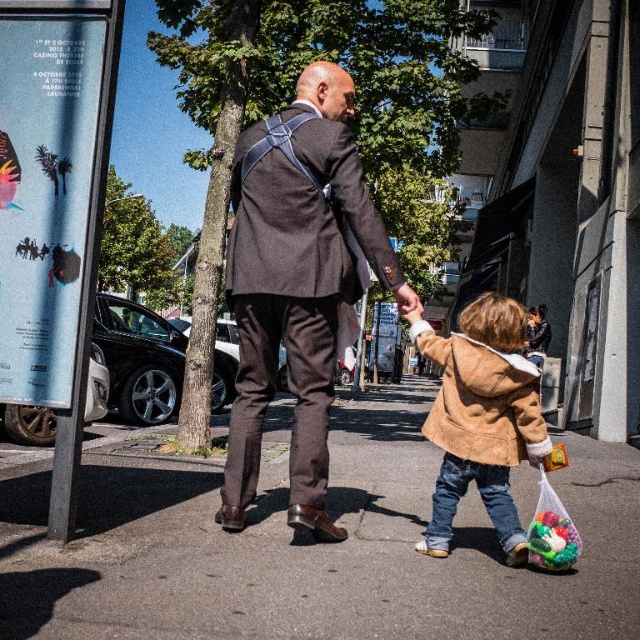
Question: Can you confirm if asphalt at center is positioned below tan suede jacket at lower right?

Choices:
 (A) yes
 (B) no

Answer: (A)

Question: Which point is closer to the camera?

Choices:
 (A) blue paper poster at left
 (B) tan suede jacket at lower right
 (C) asphalt at center
 (D) matte brown suit at center

Answer: (C)

Question: Considering the real-world distances, which object is closest to the matte brown suit at center?

Choices:
 (A) asphalt at center
 (B) blue paper poster at left
 (C) tan suede jacket at lower right
 (D) translucent plastic bag at lower right

Answer: (C)

Question: Which object is farther from the camera taking this photo?

Choices:
 (A) translucent plastic bag at lower right
 (B) matte brown suit at center

Answer: (B)

Question: Is blue paper poster at left positioned before translucent plastic bag at lower right?

Choices:
 (A) yes
 (B) no

Answer: (A)

Question: From the image, what is the correct spatial relationship of matte brown suit at center in relation to tan suede jacket at lower right?

Choices:
 (A) right
 (B) left

Answer: (B)